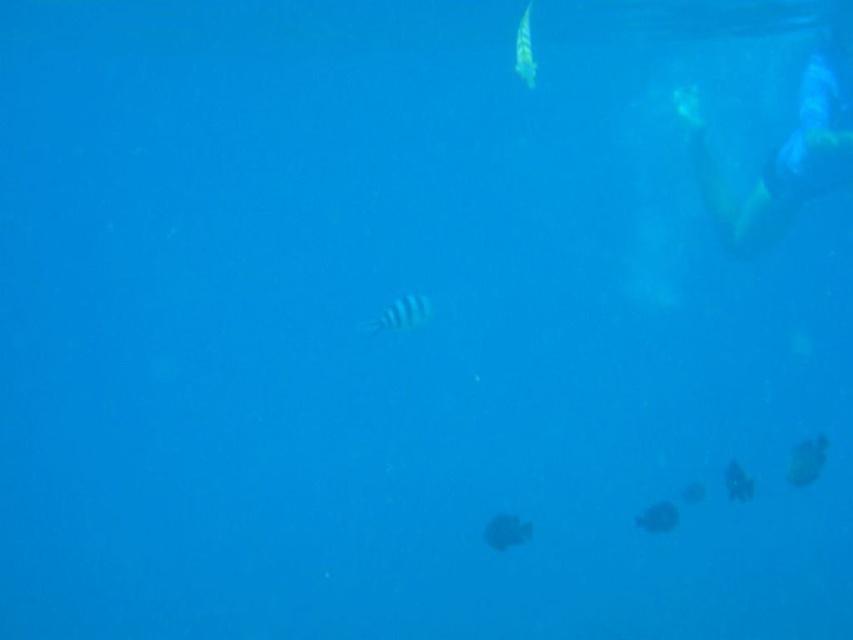
Between point (784, 140) and point (405, 326), which one is positioned in front?

Point (405, 326)

Is point (763, 173) farther from viewer compared to point (399, 324)?

Yes, it is.

Where is `yellow-green skin at upper right`? yellow-green skin at upper right is located at coordinates (780, 157).

Can you confirm if blue striped fish at center is positioned to the left of smooth gray fish at lower right?

Yes, blue striped fish at center is to the left of smooth gray fish at lower right.

Which is behind, point (378, 317) or point (643, 528)?

Point (378, 317)

Locate an element on the screen. The width and height of the screenshot is (853, 640). blue striped fish at center is located at coordinates (401, 314).

Is blue striped fish at center shorter than smooth black fish at lower right?

Yes.

Is blue striped fish at center further to camera compared to smooth black fish at lower right?

Yes, blue striped fish at center is further from the viewer.

Does point (412, 312) come closer to viewer compared to point (815, 477)?

No, (412, 312) is further to viewer.

Identify the location of blue striped fish at center. (401, 314).